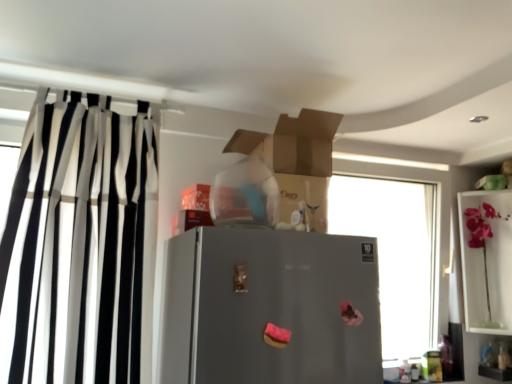
Question: From a real-world perspective, is gray matte refrigerator at center under pink glass vase at upper right?

Choices:
 (A) no
 (B) yes

Answer: (B)

Question: Does gray matte refrigerator at center have a greater height compared to pink glass vase at upper right?

Choices:
 (A) no
 (B) yes

Answer: (A)

Question: Would you say gray matte refrigerator at center is outside pink glass vase at upper right?

Choices:
 (A) yes
 (B) no

Answer: (A)

Question: Could you tell me if gray matte refrigerator at center is turned towards pink glass vase at upper right?

Choices:
 (A) no
 (B) yes

Answer: (A)

Question: Is gray matte refrigerator at center smaller than pink glass vase at upper right?

Choices:
 (A) yes
 (B) no

Answer: (A)

Question: From the image's perspective, is gray matte refrigerator at center below pink glass vase at upper right?

Choices:
 (A) yes
 (B) no

Answer: (B)

Question: From a real-world perspective, does black and white striped curtain at left stand above pink glass vase at upper right?

Choices:
 (A) no
 (B) yes

Answer: (B)

Question: Is black and white striped curtain at left shorter than pink glass vase at upper right?

Choices:
 (A) no
 (B) yes

Answer: (A)

Question: From the image's perspective, does black and white striped curtain at left appear lower than pink glass vase at upper right?

Choices:
 (A) yes
 (B) no

Answer: (B)

Question: From the image's perspective, is black and white striped curtain at left located above pink glass vase at upper right?

Choices:
 (A) yes
 (B) no

Answer: (A)

Question: Is black and white striped curtain at left to the right of pink glass vase at upper right from the viewer's perspective?

Choices:
 (A) yes
 (B) no

Answer: (B)

Question: Could you tell me if black and white striped curtain at left is turned towards pink glass vase at upper right?

Choices:
 (A) no
 (B) yes

Answer: (A)

Question: Is pink glass vase at upper right shorter than black and white striped curtain at left?

Choices:
 (A) yes
 (B) no

Answer: (A)